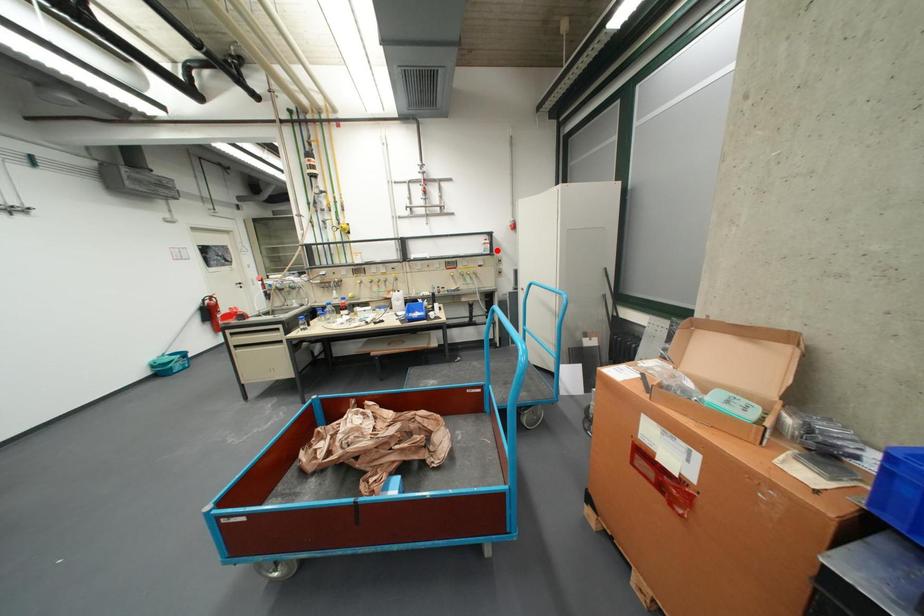
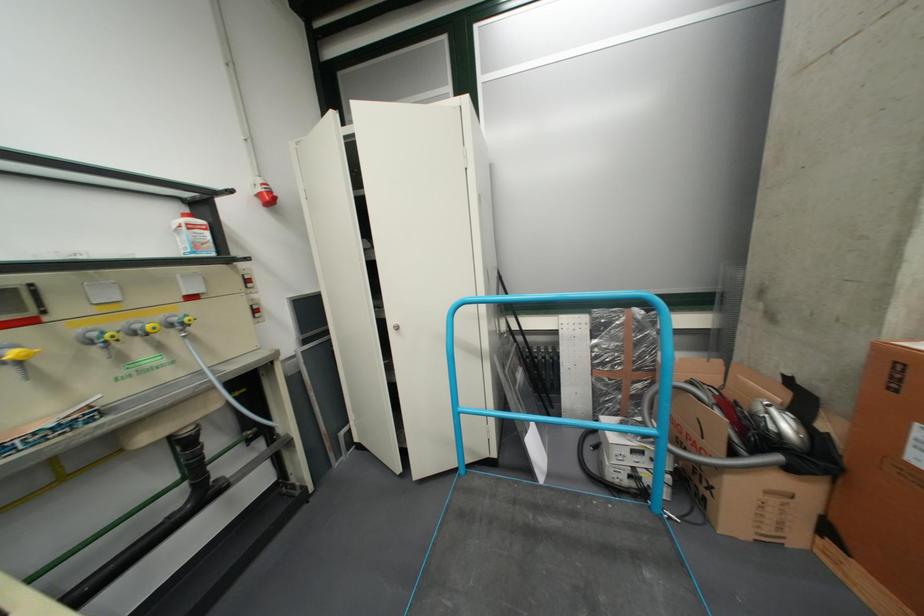
Question: I am providing you with two images of the same scene from different viewpoints. Given a red point in image1, look at the same physical point in image2. Is it:

Choices:
 (A) Closer to the viewpoint
 (B) Farther from the viewpoint

Answer: (B)